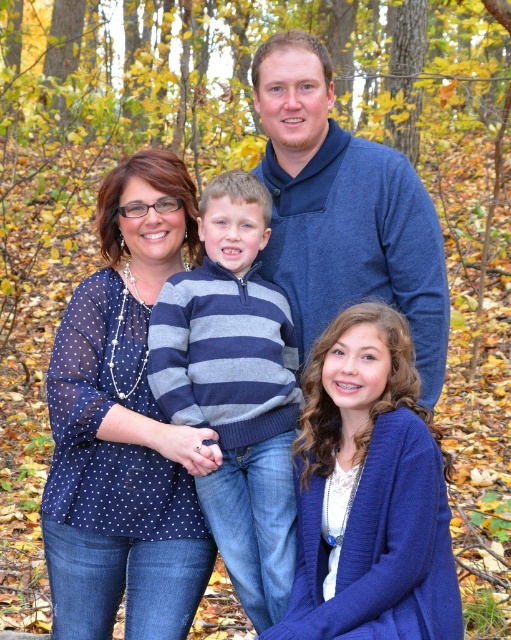
Between point (145, 422) and point (300, 484), which one is positioned behind?

The point (145, 422) is behind.

Identify the location of polka dot sheer blouse at center. (125, 428).

Does polka dot sheer blouse at center lie behind blue sweater at center?

No.

Does polka dot sheer blouse at center appear over blue sweater at center?

Actually, polka dot sheer blouse at center is below blue sweater at center.

Where is `polka dot sheer blouse at center`? The image size is (511, 640). polka dot sheer blouse at center is located at coordinates (125, 428).

Does polka dot sheer blouse at center have a lesser width compared to striped knit sweater at center?

In fact, polka dot sheer blouse at center might be wider than striped knit sweater at center.

Is polka dot sheer blouse at center smaller than striped knit sweater at center?

Incorrect, polka dot sheer blouse at center is not smaller in size than striped knit sweater at center.

Locate an element on the screen. polka dot sheer blouse at center is located at coordinates (125, 428).